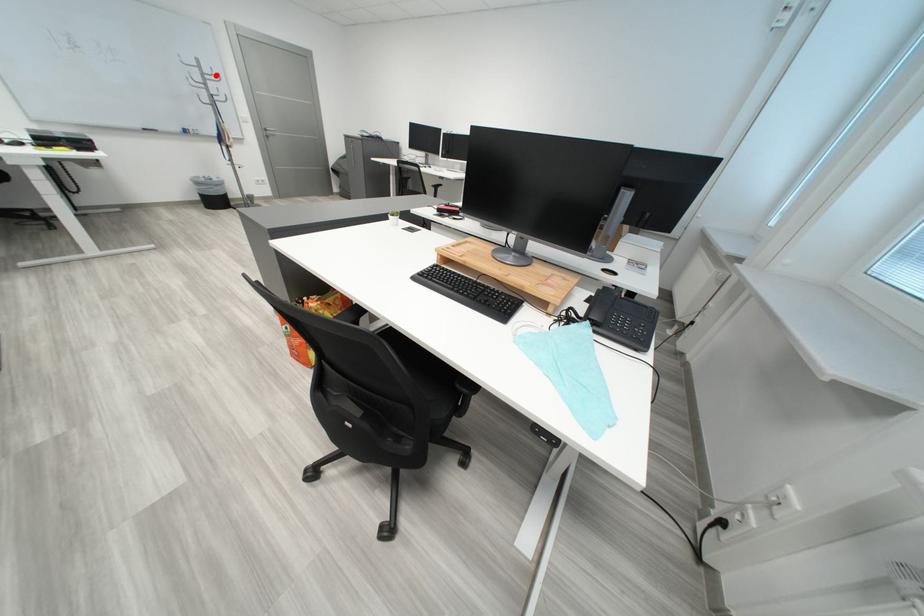
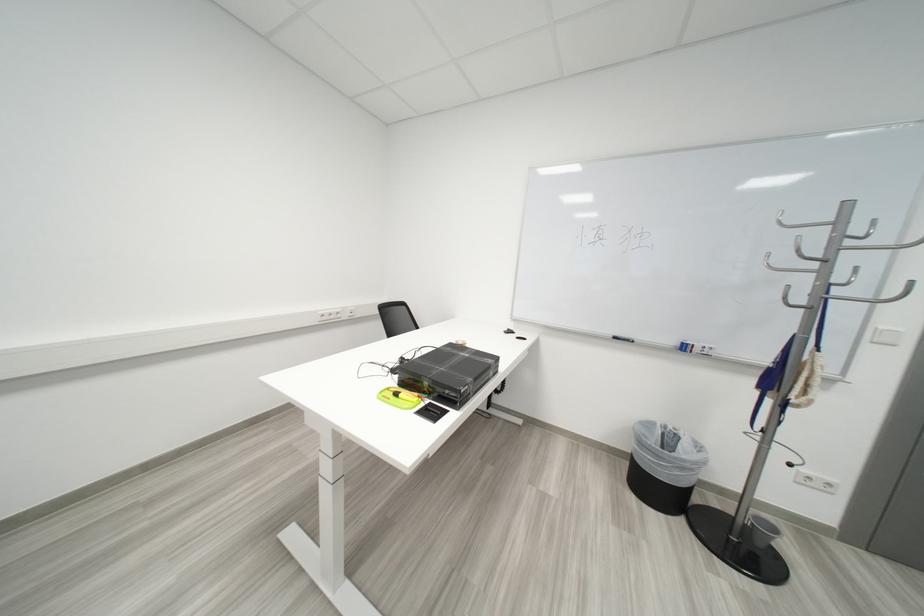
The point at the highlighted location is marked in the first image. Where is the corresponding point in the second image?

(853, 238)